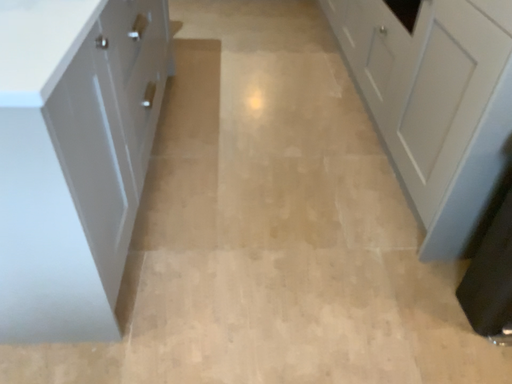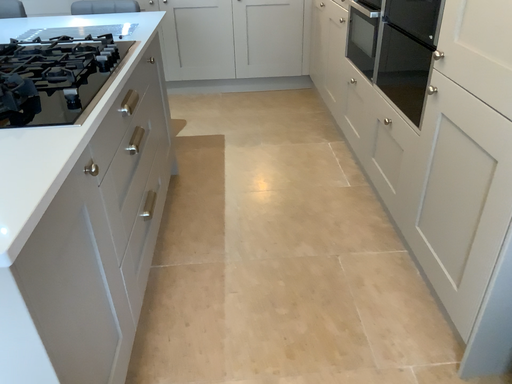
Question: How did the camera likely rotate when shooting the video?

Choices:
 (A) rotated upward
 (B) rotated downward

Answer: (A)